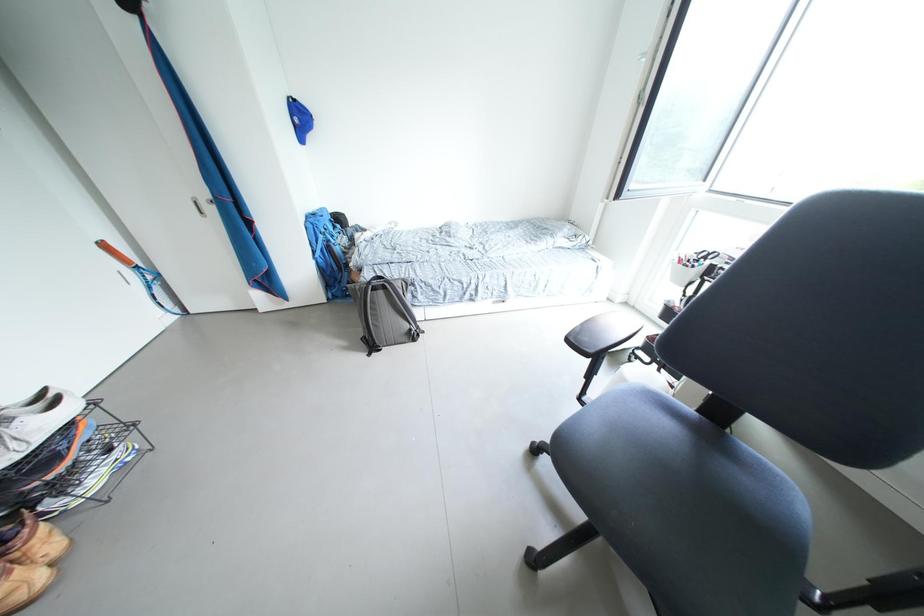
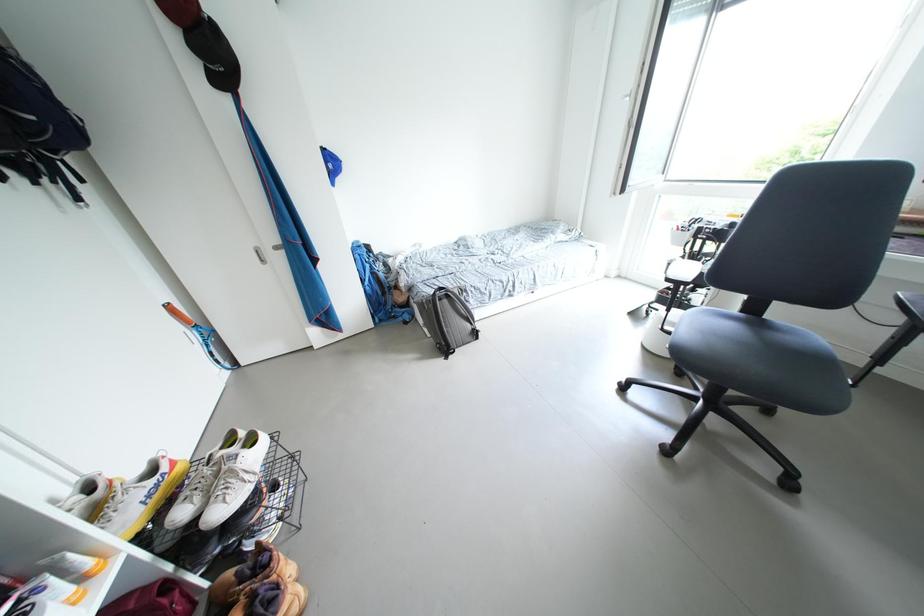
Question: The camera is either moving clockwise (left) or counter-clockwise (right) around the object. The first image is from the beginning of the video and the second image is from the end. Is the camera moving left or right when shooting the video?

Choices:
 (A) Left
 (B) Right

Answer: (A)